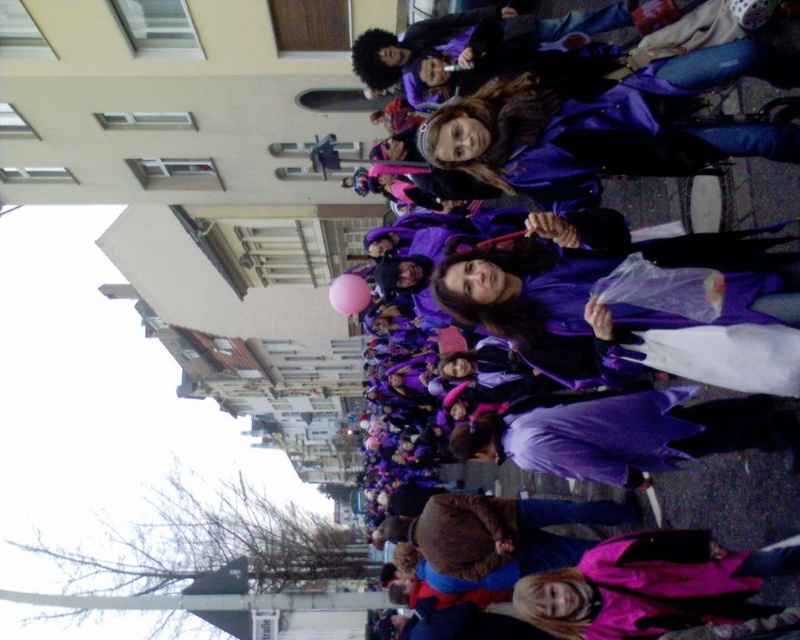
Between brown fuzzy hat at center and purple matte coat at center, which one appears on the left side from the viewer's perspective?

purple matte coat at center

Who is more distant from viewer, [440,522] or [670,36]?

Point [440,522]

Where is `brown fuzzy hat at center`? The height and width of the screenshot is (640, 800). brown fuzzy hat at center is located at coordinates (506, 532).